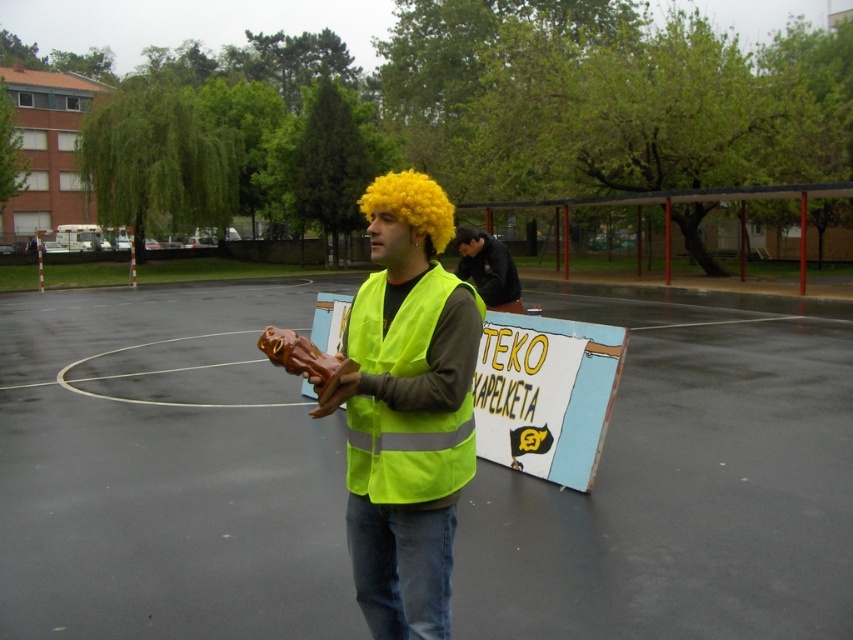
You are a fashion designer observing the outdoor scene. You see the dark brown leather jacket at center and the golden synthetic wig at center. Which item is positioned higher in the image?

The golden synthetic wig at center is positioned higher than the dark brown leather jacket at center.